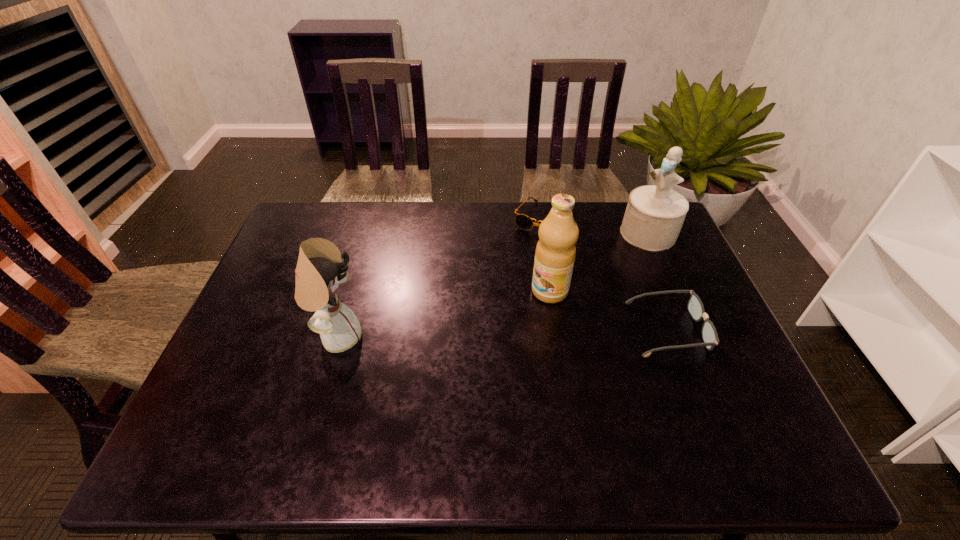
Find the location of a particular element. This screenshot has width=960, height=540. vacant space on the desktop that is between the leftmost object and the spectacles and is positioned on the label of the olive oil is located at coordinates (482, 333).

This screenshot has height=540, width=960. Identify the location of vacant space on the desktop that is between the doll and the spectacles and is positioned on the lenses of the sunglasses. (477, 334).

Locate an element on the screen. The width and height of the screenshot is (960, 540). vacant spot on the desktop that is between the doll and the spectacles and is positioned at the beak of the figurine is located at coordinates (535, 332).